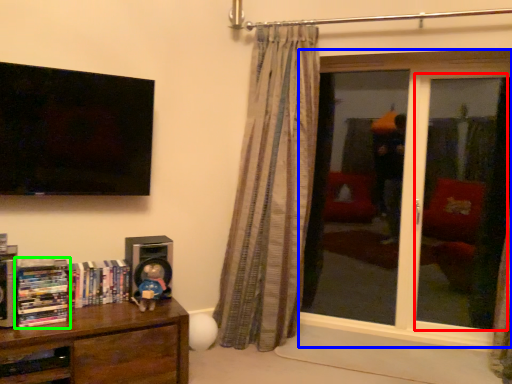
Question: Based on their relative distances, which object is farther from screen door (highlighted by a red box)? Choose from window (highlighted by a blue box) and book (highlighted by a green box).

Choices:
 (A) window
 (B) book

Answer: (B)